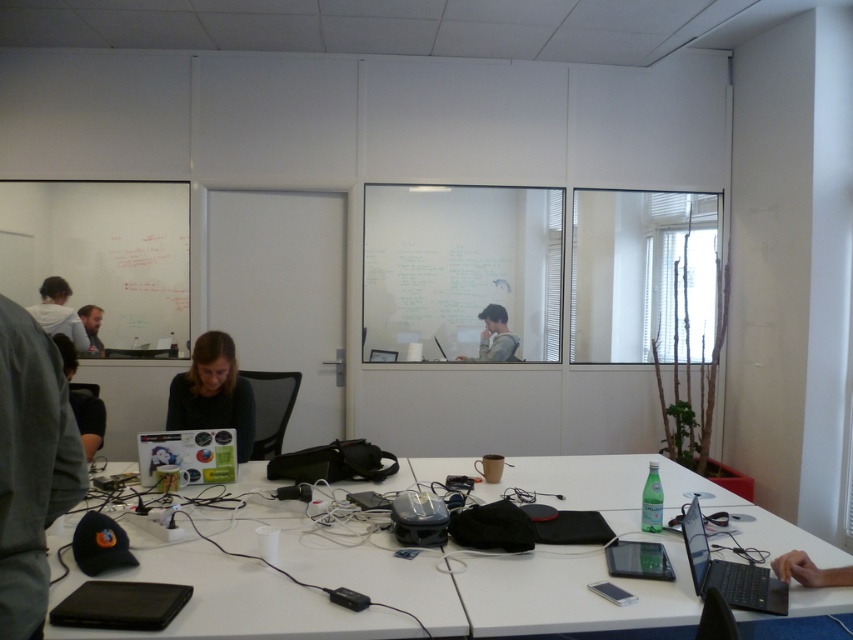
Question: Is white plastic table at center thinner than whiteboard at center?

Choices:
 (A) yes
 (B) no

Answer: (B)

Question: Is dark gray fabric shirt at left wider than matte black laptop at center?

Choices:
 (A) yes
 (B) no

Answer: (A)

Question: Is the position of white plastic table at center less distant than that of gray fabric jacket at upper center?

Choices:
 (A) no
 (B) yes

Answer: (B)

Question: Which point is closer to the camera?

Choices:
 (A) white matte shirt at upper left
 (B) dark gray fabric shirt at left
 (C) matte black laptop at lower left
 (D) bearded man at left

Answer: (B)

Question: Which object appears farthest from the camera in this image?

Choices:
 (A) white plastic table at center
 (B) bearded man at left

Answer: (B)

Question: Considering the real-world distances, which object is closest to the dark gray fabric shirt at left?

Choices:
 (A) whiteboard at upper left
 (B) bearded man at left
 (C) matte black laptop at center
 (D) gray fabric jacket at upper center

Answer: (B)